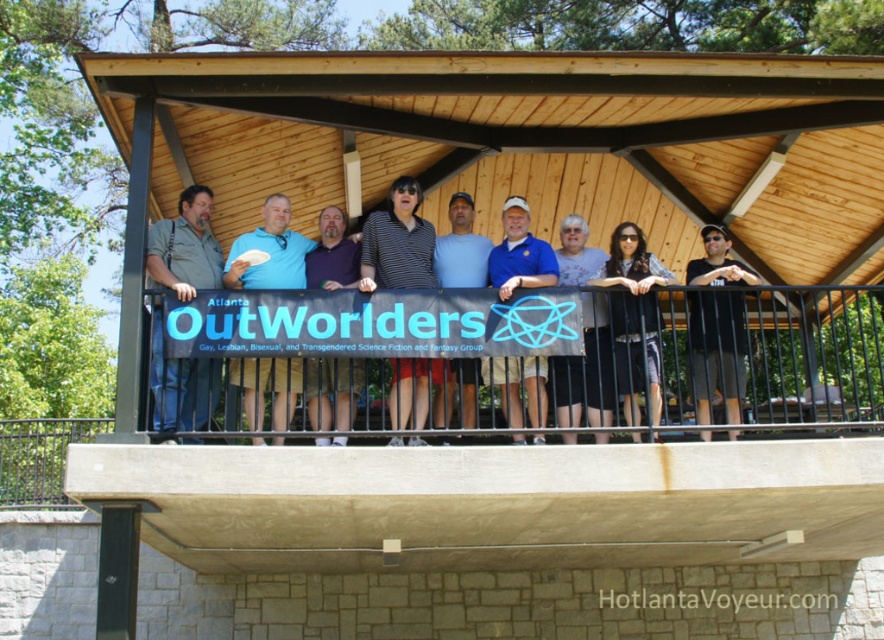
Question: Observing the image, what is the correct spatial positioning of striped polo shirt at center in reference to blue cotton polo shirt at center?

Choices:
 (A) right
 (B) left

Answer: (B)

Question: Which object appears farthest from the camera in this image?

Choices:
 (A) black matte shirt at center
 (B) striped polo shirt at center
 (C) purple shirt at center

Answer: (B)

Question: Does matte gray shirt at left appear on the right side of black matte shirt at center?

Choices:
 (A) yes
 (B) no

Answer: (B)

Question: Is the position of black matte shirt at center more distant than that of white fabric shirt at center?

Choices:
 (A) yes
 (B) no

Answer: (B)

Question: Which point is farther from the camera taking this photo?

Choices:
 (A) (690, 278)
 (B) (652, 353)
 (C) (453, 380)
 (D) (610, 372)

Answer: (A)

Question: Which point is closer to the camera?

Choices:
 (A) striped polo shirt at center
 (B) purple shirt at center

Answer: (B)